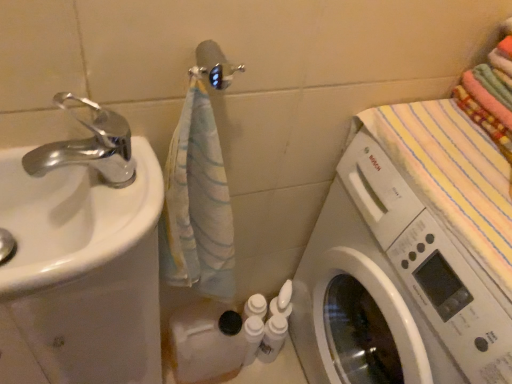
At what (x,y) coordinates should I click in order to perform the action: click on white glossy bottles at lower center, the 2th toiletry when ordered from left to right. Please return your answer as a coordinate pair (x, y). Looking at the image, I should click on (272, 338).

This screenshot has width=512, height=384. Describe the element at coordinates (252, 337) in the screenshot. I see `white plastic bottles at center, which is the second toiletry from right to left` at that location.

Find the location of `chrome metallic faucet at left`. chrome metallic faucet at left is located at coordinates (89, 147).

Find the location of a particular element. This screenshot has width=512, height=384. white glossy bottles at lower center, which appears as the first toiletry when viewed from the right is located at coordinates (272, 338).

From the picture: From a real-world perspective, is white plastic bottles at center, which is the second toiletry from right to left, located beneath chrome metallic faucet at left?

Yes, from a real-world perspective, white plastic bottles at center, which is the second toiletry from right to left, is below chrome metallic faucet at left.

Looking at the image, does white plastic bottles at center, the 1th toiletry viewed from the left, seem bigger or smaller compared to chrome metallic faucet at left?

In the image, white plastic bottles at center, the 1th toiletry viewed from the left, appears to be smaller than chrome metallic faucet at left.

Where is `tap lying above the white plastic bottles at center, the 1th toiletry viewed from the left (from the image's perspective)`? This screenshot has height=384, width=512. tap lying above the white plastic bottles at center, the 1th toiletry viewed from the left (from the image's perspective) is located at coordinates (89, 147).

Choose the correct answer: Is white plastic bottles at center, which is the second toiletry from right to left, inside chrome metallic faucet at left or outside it?

white plastic bottles at center, which is the second toiletry from right to left, is outside chrome metallic faucet at left.

Measure the distance from chrome metallic faucet at left to white plastic washing machine at right.

chrome metallic faucet at left is 20.72 inches from white plastic washing machine at right.

The width and height of the screenshot is (512, 384). I want to click on tap on the left side of white plastic washing machine at right, so click(89, 147).

Considering the positions of objects chrome metallic faucet at left and white plastic washing machine at right in the image provided, who is behind, chrome metallic faucet at left or white plastic washing machine at right?

white plastic washing machine at right is further away from the camera.

From a real-world perspective, is chrome metallic faucet at left beneath white plastic washing machine at right?

No.

In terms of width, does white glossy bottles at lower center, which appears as the first toiletry when viewed from the right, look wider or thinner when compared to chrome metallic faucet at left?

In the image, white glossy bottles at lower center, which appears as the first toiletry when viewed from the right, appears to be more narrow than chrome metallic faucet at left.

Based on the photo, from a real-world perspective, which is physically below, white glossy bottles at lower center, which appears as the first toiletry when viewed from the right, or chrome metallic faucet at left?

white glossy bottles at lower center, which appears as the first toiletry when viewed from the right, from a real-world perspective.

Does white glossy bottles at lower center, the 2th toiletry when ordered from left to right, turn towards chrome metallic faucet at left?

No, white glossy bottles at lower center, the 2th toiletry when ordered from left to right, is not oriented towards chrome metallic faucet at left.

Which object is closer to the camera taking this photo, white glossy bottles at lower center, the 2th toiletry when ordered from left to right, or chrome metallic faucet at left?

chrome metallic faucet at left.

Is white glossy sink at left turned away from white plastic bottles at center, the 1th toiletry viewed from the left?

No.

Is white glossy sink at left at the right side of white plastic bottles at center, which is the second toiletry from right to left?

No.

Choose the correct answer: Is white glossy sink at left inside white plastic bottles at center, which is the second toiletry from right to left, or outside it?

The correct answer is: outside.

Measure the distance between white plastic washing machine at right and white glossy sink at left.

They are 19.47 inches apart.

Is white plastic washing machine at right touching white glossy sink at left?

No, white plastic washing machine at right is not beside white glossy sink at left.

Which is more distant, (x=404, y=330) or (x=108, y=204)?

Point (x=404, y=330)

From the image's perspective, is white plastic washing machine at right on top of white glossy sink at left?

Actually, white plastic washing machine at right appears below white glossy sink at left in the image.

You are a GUI agent. You are given a task and a screenshot of the screen. Output one action in this format:
    pyautogui.click(x=<x>, y=<y>)
    Task: Click on the toiletry that is above the white plastic bottles at center, which is the second toiletry from right to left (from a real-world perspective)
    
    Given the screenshot: What is the action you would take?
    pyautogui.click(x=272, y=338)

Between point (275, 333) and point (260, 318), which one is positioned in front?

Point (275, 333)

Which object is more forward, white glossy bottles at lower center, the 2th toiletry when ordered from left to right, or white plastic bottles at center, the 1th toiletry viewed from the left?

white plastic bottles at center, the 1th toiletry viewed from the left, is in front.

Is chrome metallic faucet at left thinner than white plastic bottles at center, the 1th toiletry viewed from the left?

Incorrect, the width of chrome metallic faucet at left is not less than that of white plastic bottles at center, the 1th toiletry viewed from the left.

From a real-world perspective, which object rests below the other?

In real-world perspective, white plastic bottles at center, which is the second toiletry from right to left, is lower.

Considering the sizes of objects chrome metallic faucet at left and white plastic bottles at center, the 1th toiletry viewed from the left, in the image provided, who is shorter, chrome metallic faucet at left or white plastic bottles at center, the 1th toiletry viewed from the left,?

With less height is chrome metallic faucet at left.

Is chrome metallic faucet at left bigger or smaller than white plastic bottles at center, the 1th toiletry viewed from the left?

Clearly, chrome metallic faucet at left is larger in size than white plastic bottles at center, the 1th toiletry viewed from the left.

In order to click on tap located in front of the white plastic bottles at center, the 1th toiletry viewed from the left in this screenshot , I will do `click(89, 147)`.

Locate an element on the screen. Image resolution: width=512 pixels, height=384 pixels. tap lying above the white plastic washing machine at right (from the image's perspective) is located at coordinates (89, 147).

Looking at the image, which one is located closer to white glossy sink at left, white plastic bottles at center, which is the second toiletry from right to left, or white glossy bottles at lower center, which appears as the first toiletry when viewed from the right?

white plastic bottles at center, which is the second toiletry from right to left, lies closer to white glossy sink at left than the other object.

Estimate the real-world distances between objects in this image. Which object is further from white plastic washing machine at right, chrome metallic faucet at left or white plastic bottles at center, which is the second toiletry from right to left?

chrome metallic faucet at left is positioned further to the anchor white plastic washing machine at right.

When comparing their distances from white glossy bottles at lower center, the 2th toiletry when ordered from left to right, does white plastic bottles at center, the 1th toiletry viewed from the left, or chrome metallic faucet at left seem closer?

white plastic bottles at center, the 1th toiletry viewed from the left, lies closer to white glossy bottles at lower center, the 2th toiletry when ordered from left to right, than the other object.

Looking at the image, which one is located further to chrome metallic faucet at left, white plastic washing machine at right or white glossy sink at left?

white plastic washing machine at right is further to chrome metallic faucet at left.

When comparing their distances from white plastic bottles at center, the 1th toiletry viewed from the left, does white plastic washing machine at right or white glossy bottles at lower center, which appears as the first toiletry when viewed from the right, seem closer?

Based on the image, white glossy bottles at lower center, which appears as the first toiletry when viewed from the right, appears to be nearer to white plastic bottles at center, the 1th toiletry viewed from the left.

When comparing their distances from white glossy sink at left, does white glossy bottles at lower center, which appears as the first toiletry when viewed from the right, or chrome metallic faucet at left seem closer?

chrome metallic faucet at left is positioned closer to the anchor white glossy sink at left.

Looking at the image, which one is located further to white plastic washing machine at right, white glossy sink at left or white glossy bottles at lower center, which appears as the first toiletry when viewed from the right?

white glossy sink at left is further to white plastic washing machine at right.

Looking at this image, based on their spatial positions, is chrome metallic faucet at left or white plastic washing machine at right further from white glossy bottles at lower center, which appears as the first toiletry when viewed from the right?

chrome metallic faucet at left is positioned further to the anchor white glossy bottles at lower center, which appears as the first toiletry when viewed from the right.

In order to click on tap between white glossy sink at left and white glossy bottles at lower center, the 2th toiletry when ordered from left to right, from front to back in this screenshot , I will do coord(89,147).

I want to click on washing machine located between chrome metallic faucet at left and white plastic bottles at center, which is the second toiletry from right to left, in the depth direction, so click(x=392, y=288).

Where is `washing machine between white glossy sink at left and white glossy bottles at lower center, which appears as the first toiletry when viewed from the right, from front to back`? The image size is (512, 384). washing machine between white glossy sink at left and white glossy bottles at lower center, which appears as the first toiletry when viewed from the right, from front to back is located at coordinates (392, 288).

What are the coordinates of `washing machine between chrome metallic faucet at left and white glossy bottles at lower center, the 2th toiletry when ordered from left to right, from front to back` in the screenshot? It's located at (392, 288).